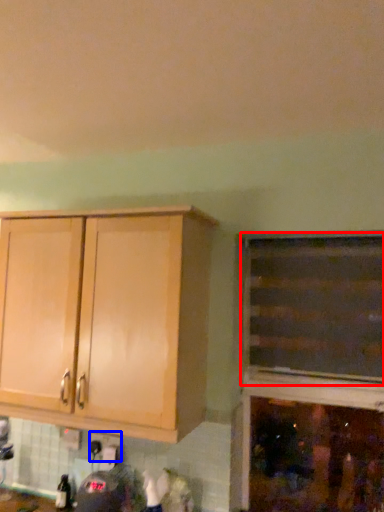
Question: Which of the following is the closest to the observer, cabinetry (highlighted by a red box) or electric outlet (highlighted by a blue box)?

Choices:
 (A) cabinetry
 (B) electric outlet

Answer: (A)